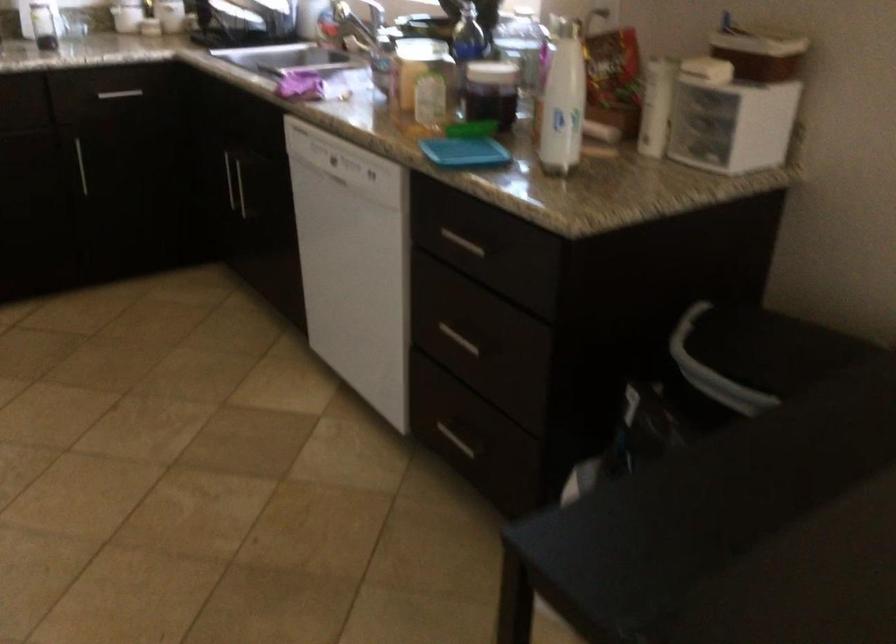
Describe the element at coordinates (346, 15) in the screenshot. The width and height of the screenshot is (896, 644). I see `a faucet handle` at that location.